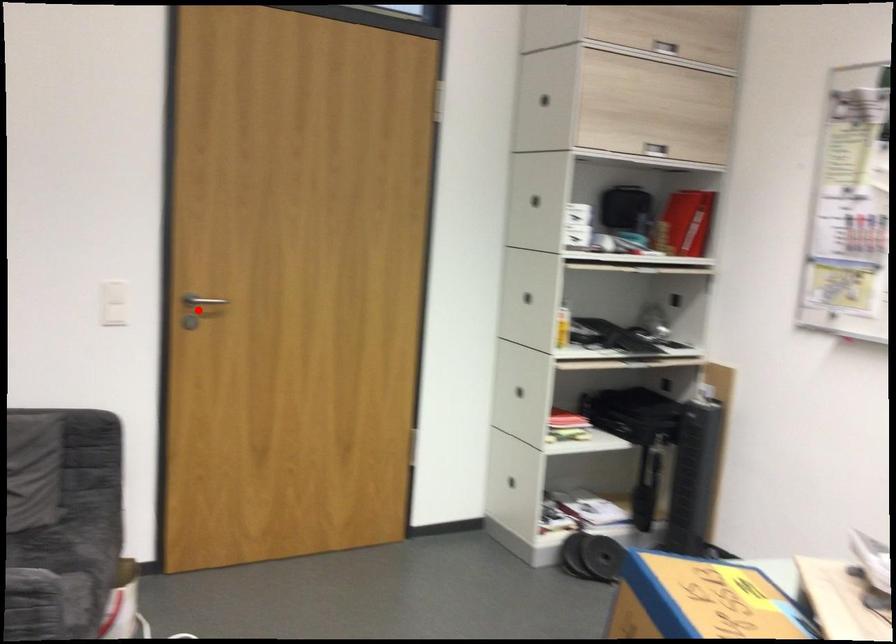
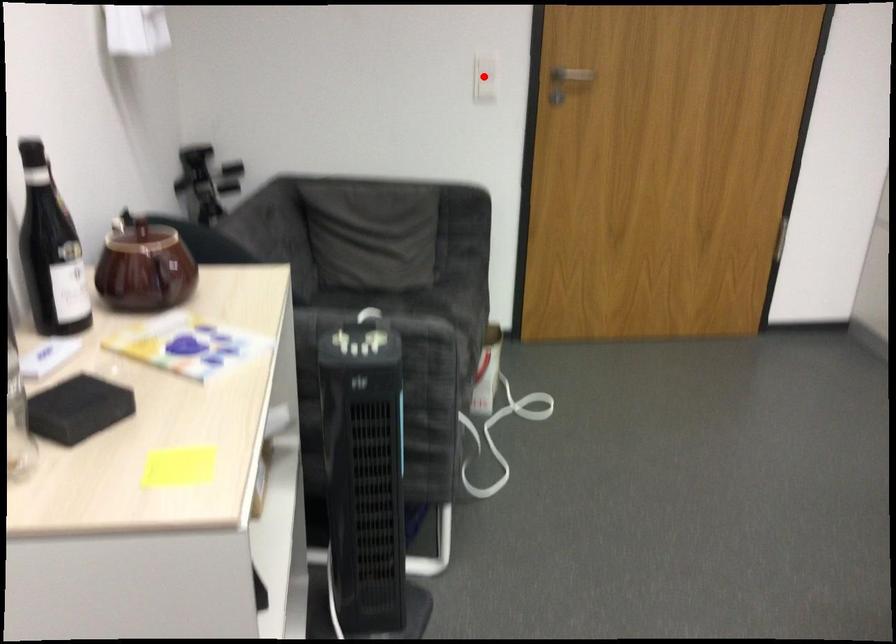
I am providing you with two images of the same scene from different viewpoints. A red point is marked on the first image and another point is marked on the second image. Do the highlighted points in image1 and image2 indicate the same real-world spot?

No